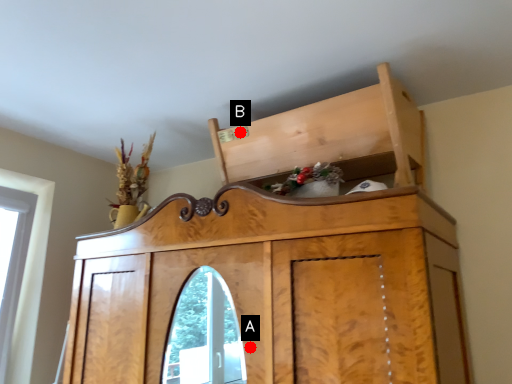
Question: Two points are circled on the image, labeled by A and B beside each circle. Which point is further to the camera?

Choices:
 (A) A is further
 (B) B is further

Answer: (B)